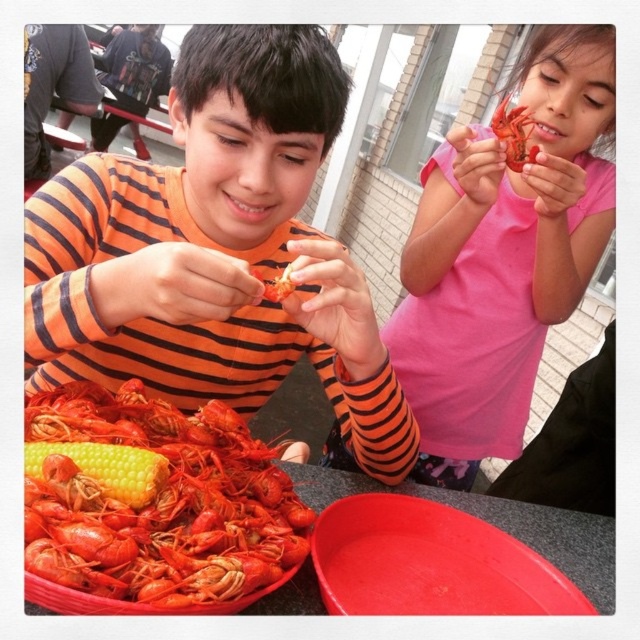
Who is more distant from viewer, (520,300) or (44,451)?

The point (520,300) is behind.

You are a GUI agent. You are given a task and a screenshot of the screen. Output one action in this format:
    pyautogui.click(x=<x>, y=<y>)
    Task: Click on the pink matte crayfish at upper right
    The image size is (640, 640).
    Given the screenshot: What is the action you would take?
    pyautogui.click(x=502, y=257)

Between orange striped shirt at center and pink matte crayfish at upper right, which one has more height?

With more height is pink matte crayfish at upper right.

At what (x,y) coordinates should I click in order to perform the action: click on orange striped shirt at center. Please return your answer as a coordinate pair (x, y). This screenshot has width=640, height=640. Looking at the image, I should click on (216, 250).

Find the location of a particular element. This screenshot has width=640, height=640. pink matte crayfish at upper right is located at coordinates (502, 257).

Which is above, pink matte crayfish at upper right or shiny red lobster at lower left?

pink matte crayfish at upper right

Between point (572, 253) and point (72, 413), which one is positioned behind?

Positioned behind is point (572, 253).

Where is `pink matte crayfish at upper right`? This screenshot has height=640, width=640. pink matte crayfish at upper right is located at coordinates (502, 257).